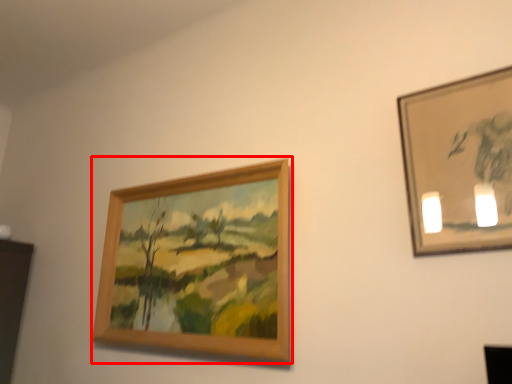
Question: Where is picture frame (annotated by the red box) located in relation to picture frame in the image?

Choices:
 (A) right
 (B) left

Answer: (B)